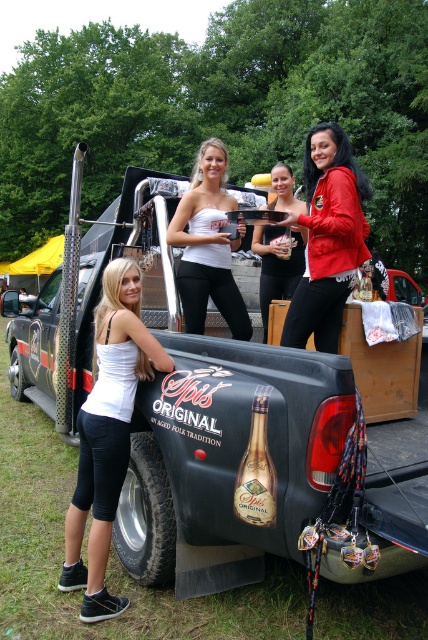
Question: Among these points, which one is farthest from the camera?

Choices:
 (A) (311, 198)
 (B) (261, 422)

Answer: (A)

Question: Which object appears farthest from the camera in this image?

Choices:
 (A) red leather jacket at center
 (B) gold metallic champagne at center

Answer: (A)

Question: Is white fabric tank top at lower left to the left of red leather jacket at center from the viewer's perspective?

Choices:
 (A) no
 (B) yes

Answer: (B)

Question: Does red leather jacket at center lie in front of matte black trophy at center?

Choices:
 (A) yes
 (B) no

Answer: (A)

Question: Observing the image, what is the correct spatial positioning of black matte truck at center in reference to white fabric tank top at lower left?

Choices:
 (A) below
 (B) above

Answer: (A)

Question: Estimate the real-world distances between objects in this image. Which object is farther from the white matte tank top at center?

Choices:
 (A) black matte truck at center
 (B) red leather jacket at center
 (C) gold metallic champagne at center

Answer: (A)